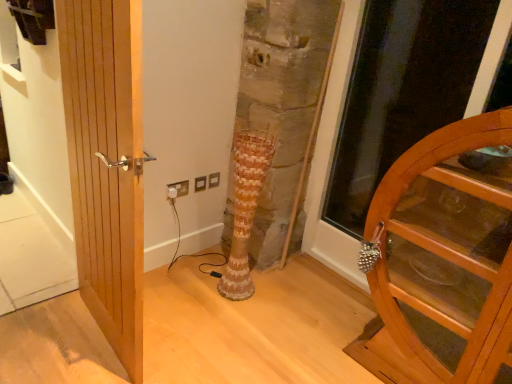
Locate an element on the screen. transparent wooden door at right is located at coordinates (402, 91).

In order to click on white plastic electric outlet at lower center in this screenshot , I will do `click(177, 189)`.

The image size is (512, 384). Find the location of `natural wood door at left, the second door when ordered from right to left`. natural wood door at left, the second door when ordered from right to left is located at coordinates (104, 164).

What are the coordinates of `brown textured vase at center` in the screenshot? It's located at (245, 208).

At what (x,y) coordinates should I click in order to perform the action: click on wooden cabinet at right, which is the second door in left-to-right order. Please return your answer as a coordinate pair (x, y). The image size is (512, 384). Looking at the image, I should click on (442, 263).

Is natural wood door at left, which is the first door from left to right, far away from brown textured vase at center?

No, natural wood door at left, which is the first door from left to right, is not far from brown textured vase at center.

From the image's perspective, which one is positioned lower, natural wood door at left, the second door when ordered from right to left, or brown textured vase at center?

brown textured vase at center is shown below in the image.

Can you confirm if natural wood door at left, the second door when ordered from right to left, is taller than brown textured vase at center?

Yes.

There is a brown textured vase at center. Where is `the 2nd door above it (from a real-world perspective)`? The image size is (512, 384). the 2nd door above it (from a real-world perspective) is located at coordinates (104, 164).

Looking at their sizes, would you say wooden cabinet at right, which is the second door in left-to-right order, is wider or thinner than transparent wooden door at right?

Clearly, wooden cabinet at right, which is the second door in left-to-right order, has less width compared to transparent wooden door at right.

From the picture: Which object is closer to the camera taking this photo, wooden cabinet at right, which is the second door in left-to-right order, or transparent wooden door at right?

wooden cabinet at right, which is the second door in left-to-right order, is more forward.

Measure the distance between wooden cabinet at right, the first door positioned from the right, and transparent wooden door at right.

They are 1.15 meters apart.

In the scene shown: Choose the correct answer: Is wooden cabinet at right, the first door positioned from the right, inside transparent wooden door at right or outside it?

wooden cabinet at right, the first door positioned from the right, is outside transparent wooden door at right.

Between white plastic electric outlet at lower center and transparent wooden door at right, which one appears on the left side from the viewer's perspective?

white plastic electric outlet at lower center.

Measure the distance from white plastic electric outlet at lower center to transparent wooden door at right.

They are 1.69 meters apart.

Which is behind, point (182, 181) or point (423, 56)?

Point (423, 56)

From the image's perspective, which one is positioned higher, white plastic electric outlet at lower center or transparent wooden door at right?

From the image's view, transparent wooden door at right is above.

Could you measure the distance between wooden cabinet at right, the first door positioned from the right, and white plastic electric outlet at lower center?

The distance of wooden cabinet at right, the first door positioned from the right, from white plastic electric outlet at lower center is 4.67 feet.

Who is smaller, wooden cabinet at right, which is the second door in left-to-right order, or white plastic electric outlet at lower center?

With smaller size is white plastic electric outlet at lower center.

Between wooden cabinet at right, the first door positioned from the right, and white plastic electric outlet at lower center, which one has less height?

With less height is white plastic electric outlet at lower center.

Choose the correct answer: Is wooden cabinet at right, the first door positioned from the right, inside white plastic electric outlet at lower center or outside it?

wooden cabinet at right, the first door positioned from the right, is outside white plastic electric outlet at lower center.

From the picture: Would you say natural wood door at left, the second door when ordered from right to left, contains white plastic electric outlet at lower center?

Actually, white plastic electric outlet at lower center is outside natural wood door at left, the second door when ordered from right to left.

Does natural wood door at left, the second door when ordered from right to left, have a greater height compared to white plastic electric outlet at lower center?

Yes.

Can you confirm if natural wood door at left, the second door when ordered from right to left, is thinner than white plastic electric outlet at lower center?

In fact, natural wood door at left, the second door when ordered from right to left, might be wider than white plastic electric outlet at lower center.

From the image's perspective, does wooden cabinet at right, which is the second door in left-to-right order, appear lower than natural wood door at left, the second door when ordered from right to left?

Correct, wooden cabinet at right, which is the second door in left-to-right order, appears lower than natural wood door at left, the second door when ordered from right to left, in the image.

From a real-world perspective, is wooden cabinet at right, which is the second door in left-to-right order, located higher than natural wood door at left, which is the first door from left to right?

Actually, wooden cabinet at right, which is the second door in left-to-right order, is physically below natural wood door at left, which is the first door from left to right, in the real world.

Is wooden cabinet at right, the first door positioned from the right, to the left or to the right of natural wood door at left, which is the first door from left to right, in the image?

In the image, wooden cabinet at right, the first door positioned from the right, appears on the right side of natural wood door at left, which is the first door from left to right.

Is wooden cabinet at right, which is the second door in left-to-right order, inside the boundaries of natural wood door at left, which is the first door from left to right, or outside?

wooden cabinet at right, which is the second door in left-to-right order, is not inside natural wood door at left, which is the first door from left to right, it's outside.

Which of these two, transparent wooden door at right or wooden cabinet at right, which is the second door in left-to-right order, is wider?

transparent wooden door at right is wider.

Would you say transparent wooden door at right is a long distance from wooden cabinet at right, which is the second door in left-to-right order?

transparent wooden door at right is positioned a significant distance from wooden cabinet at right, which is the second door in left-to-right order.

Is transparent wooden door at right oriented away from wooden cabinet at right, the first door positioned from the right?

transparent wooden door at right does not have its back to wooden cabinet at right, the first door positioned from the right.

Is transparent wooden door at right surrounding wooden cabinet at right, which is the second door in left-to-right order?

No, wooden cabinet at right, which is the second door in left-to-right order, is located outside of transparent wooden door at right.

Locate an element on the screen. This screenshot has height=384, width=512. door on the left of brown textured vase at center is located at coordinates (104, 164).

Where is `the 2nd door directly beneath the transparent wooden door at right (from a real-world perspective)`? The width and height of the screenshot is (512, 384). the 2nd door directly beneath the transparent wooden door at right (from a real-world perspective) is located at coordinates (442, 263).

Considering their positions, is white plastic electric outlet at lower center positioned further to wooden cabinet at right, the first door positioned from the right, than brown textured vase at center?

Among the two, white plastic electric outlet at lower center is located further to wooden cabinet at right, the first door positioned from the right.

Looking at the image, which one is located further to natural wood door at left, which is the first door from left to right, wooden cabinet at right, which is the second door in left-to-right order, or white plastic electric outlet at lower center?

wooden cabinet at right, which is the second door in left-to-right order, lies further to natural wood door at left, which is the first door from left to right, than the other object.

Based on their spatial positions, is wooden cabinet at right, which is the second door in left-to-right order, or transparent wooden door at right closer to natural wood door at left, the second door when ordered from right to left?

wooden cabinet at right, which is the second door in left-to-right order, is closer to natural wood door at left, the second door when ordered from right to left.

Which object lies nearer to the anchor point natural wood door at left, the second door when ordered from right to left, transparent wooden door at right or brown textured vase at center?

brown textured vase at center is positioned closer to the anchor natural wood door at left, the second door when ordered from right to left.

When comparing their distances from transparent wooden door at right, does white plastic electric outlet at lower center or wooden cabinet at right, which is the second door in left-to-right order, seem further?

The object further to transparent wooden door at right is white plastic electric outlet at lower center.

Considering their positions, is transparent wooden door at right positioned further to white plastic electric outlet at lower center than wooden cabinet at right, the first door positioned from the right?

Among the two, transparent wooden door at right is located further to white plastic electric outlet at lower center.

From the image, which object appears to be farther from white plastic electric outlet at lower center, wooden cabinet at right, which is the second door in left-to-right order, or transparent wooden door at right?

Among the two, transparent wooden door at right is located further to white plastic electric outlet at lower center.

Estimate the real-world distances between objects in this image. Which object is closer to white plastic electric outlet at lower center, transparent wooden door at right or natural wood door at left, the second door when ordered from right to left?

natural wood door at left, the second door when ordered from right to left, is positioned closer to the anchor white plastic electric outlet at lower center.

This screenshot has height=384, width=512. I want to click on electric outlet situated between natural wood door at left, the second door when ordered from right to left, and transparent wooden door at right from left to right, so click(x=177, y=189).

Find the location of a particular element. This screenshot has height=384, width=512. door between brown textured vase at center and transparent wooden door at right in the horizontal direction is located at coordinates (442, 263).

Find the location of `tree trunk located between natural wood door at left, the second door when ordered from right to left, and transparent wooden door at right in the left-right direction`. tree trunk located between natural wood door at left, the second door when ordered from right to left, and transparent wooden door at right in the left-right direction is located at coordinates (245, 208).

At what (x,y) coordinates should I click in order to perform the action: click on tree trunk between natural wood door at left, which is the first door from left to right, and wooden cabinet at right, the first door positioned from the right, from left to right. Please return your answer as a coordinate pair (x, y). This screenshot has width=512, height=384. Looking at the image, I should click on (245, 208).